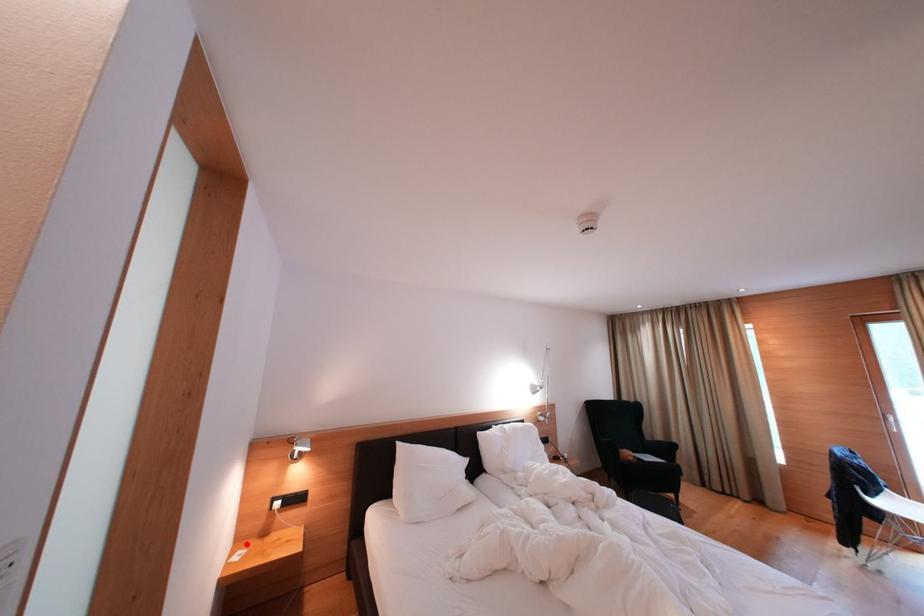
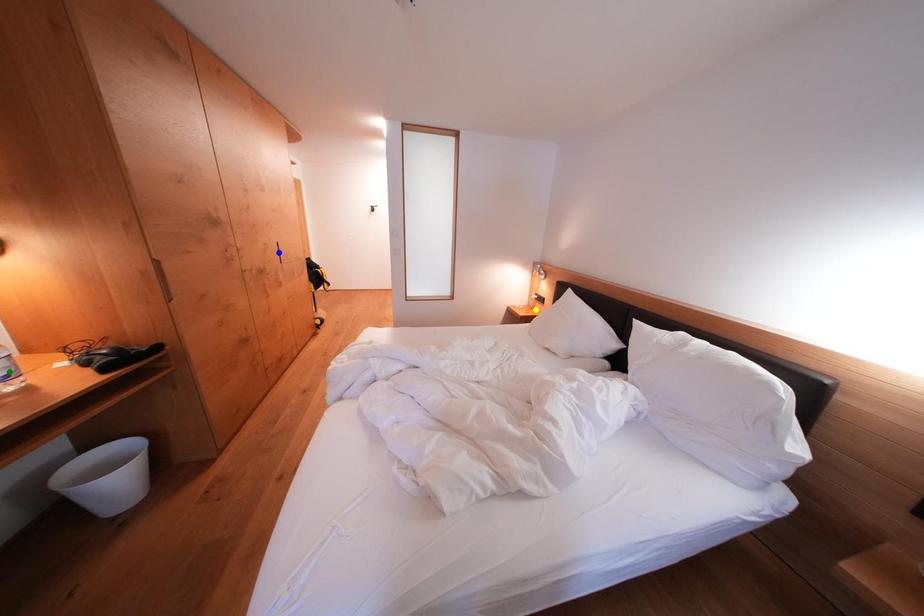
Question: I am providing you with two images of the same scene from different viewpoints. A red point is marked on the first image. You are given multiple points on the second image. Which spot in image 2 lines up with the point in image 1?

Choices:
 (A) blue point
 (B) green point
 (C) yellow point

Answer: (C)